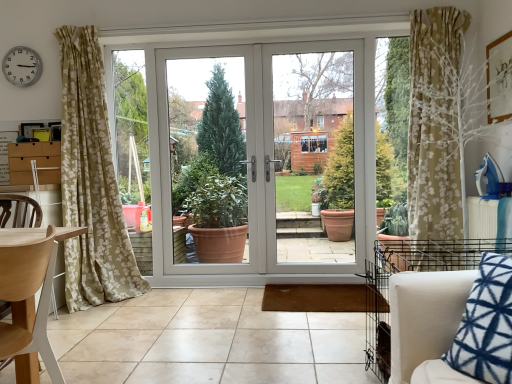
Question: Is white glossy door at center beside silver metallic clock at upper left?

Choices:
 (A) no
 (B) yes

Answer: (A)

Question: Can you confirm if white glossy door at center is thinner than silver metallic clock at upper left?

Choices:
 (A) yes
 (B) no

Answer: (B)

Question: Can you confirm if white glossy door at center is wider than silver metallic clock at upper left?

Choices:
 (A) yes
 (B) no

Answer: (A)

Question: Is silver metallic clock at upper left completely or partially inside white glossy door at center?

Choices:
 (A) no
 (B) yes

Answer: (A)

Question: From the image's perspective, does white glossy door at center appear higher than silver metallic clock at upper left?

Choices:
 (A) yes
 (B) no

Answer: (B)

Question: From the image's perspective, is light wood chair at left positioned above or below white glossy door at center?

Choices:
 (A) above
 (B) below

Answer: (B)

Question: Do you think light wood chair at left is within white glossy door at center, or outside of it?

Choices:
 (A) inside
 (B) outside

Answer: (B)

Question: Is light wood chair at left in front of or behind white glossy door at center in the image?

Choices:
 (A) behind
 (B) front

Answer: (B)

Question: Is light wood chair at left to the left or to the right of white glossy door at center in the image?

Choices:
 (A) left
 (B) right

Answer: (A)

Question: Would you say silver metallic clock at upper left is to the left or to the right of light wood chair at left in the picture?

Choices:
 (A) left
 (B) right

Answer: (A)

Question: From their relative heights in the image, would you say silver metallic clock at upper left is taller or shorter than light wood chair at left?

Choices:
 (A) tall
 (B) short

Answer: (B)

Question: Is silver metallic clock at upper left bigger or smaller than light wood chair at left?

Choices:
 (A) big
 (B) small

Answer: (B)

Question: Do you think silver metallic clock at upper left is within light wood chair at left, or outside of it?

Choices:
 (A) outside
 (B) inside

Answer: (A)

Question: Looking at the image, does light wood chair at left seem bigger or smaller compared to wooden picture frame at upper right?

Choices:
 (A) small
 (B) big

Answer: (B)

Question: Is point (44, 271) closer or farther from the camera than point (500, 52)?

Choices:
 (A) closer
 (B) farther

Answer: (A)